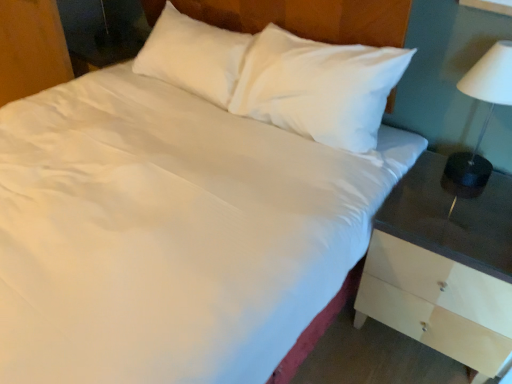
Question: Choose the correct answer: Is white wood nightstand at right inside white glossy lampshade at right or outside it?

Choices:
 (A) outside
 (B) inside

Answer: (A)

Question: Considering the positions of white wood nightstand at right and white glossy lampshade at right in the image, is white wood nightstand at right wider or thinner than white glossy lampshade at right?

Choices:
 (A) wide
 (B) thin

Answer: (A)

Question: Which object is the closest to the white glossy lampshade at right?

Choices:
 (A) wooden dresser at lower left
 (B) white wood nightstand at right

Answer: (B)

Question: Estimate the real-world distances between objects in this image. Which object is closer to the wooden dresser at lower left?

Choices:
 (A) white glossy lampshade at right
 (B) white wood nightstand at right

Answer: (B)